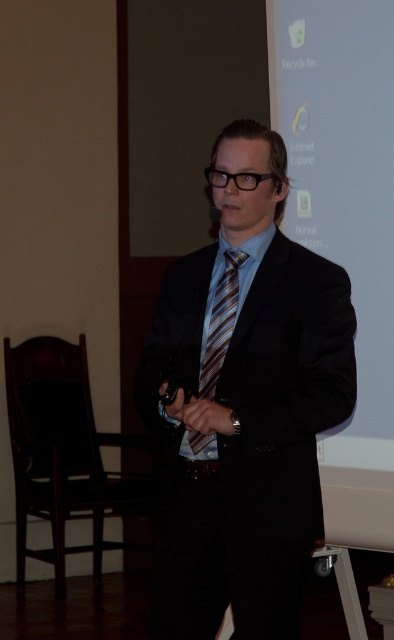
Question: Can you confirm if matte black suit at center is positioned above brown striped tie at center?

Choices:
 (A) no
 (B) yes

Answer: (A)

Question: Estimate the real-world distances between objects in this image. Which object is farther from the brown striped tie at center?

Choices:
 (A) white matte projection screen at upper center
 (B) matte black suit at center

Answer: (A)

Question: Can you confirm if matte black suit at center is thinner than brown striped tie at center?

Choices:
 (A) yes
 (B) no

Answer: (B)

Question: Among these objects, which one is farthest from the camera?

Choices:
 (A) matte black suit at center
 (B) white matte projection screen at upper center
 (C) brown striped tie at center

Answer: (B)

Question: Which object appears farthest from the camera in this image?

Choices:
 (A) white matte projection screen at upper center
 (B) matte black suit at center
 (C) brown striped tie at center

Answer: (A)

Question: Is matte black suit at center positioned before white matte projection screen at upper center?

Choices:
 (A) no
 (B) yes

Answer: (B)